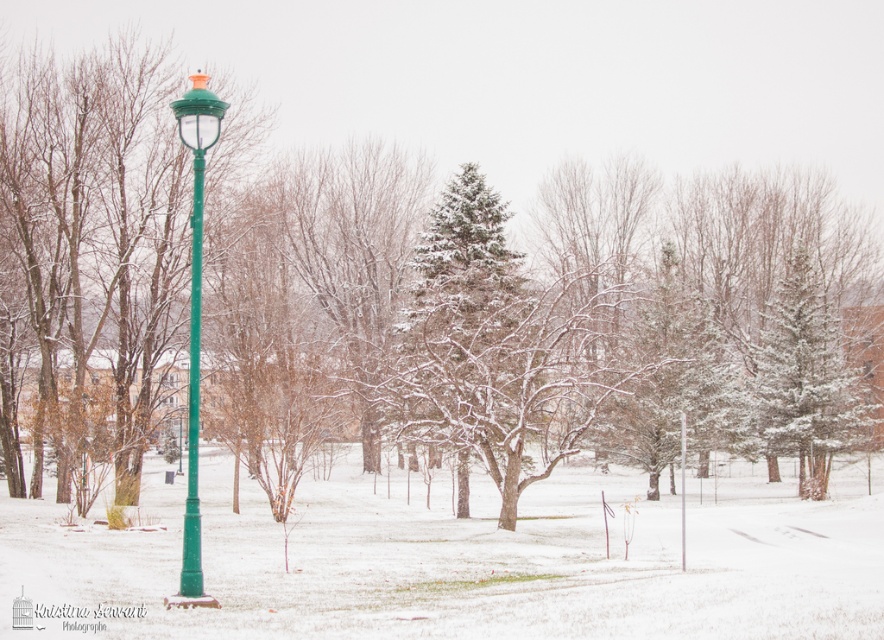
Who is lower down, green matte pole at left or green plastic pole at center?

green plastic pole at center is below.

Is green matte pole at left to the left of green plastic pole at center from the viewer's perspective?

Yes, green matte pole at left is to the left of green plastic pole at center.

Is point (189, 564) behind point (683, 474)?

No, (189, 564) is closer to viewer.

You are a GUI agent. You are given a task and a screenshot of the screen. Output one action in this format:
    pyautogui.click(x=<x>, y=<y>)
    Task: Click on the green matte pole at left
    The height and width of the screenshot is (640, 884).
    Given the screenshot: What is the action you would take?
    pyautogui.click(x=193, y=400)

How far apart are green matte street light at left and green matte pole at left?

green matte street light at left and green matte pole at left are 16.39 inches apart from each other.

Who is positioned more to the right, green matte street light at left or green matte pole at left?

green matte pole at left is more to the right.

Identify the location of green matte street light at left. Image resolution: width=884 pixels, height=640 pixels. (195, 321).

Consider the image. Is green matte street light at left closer to the viewer compared to green plastic pole at center?

Yes, green matte street light at left is closer to the viewer.

Can you confirm if green matte street light at left is bigger than green plastic pole at center?

Incorrect, green matte street light at left is not larger than green plastic pole at center.

Identify the location of green matte street light at left. (195, 321).